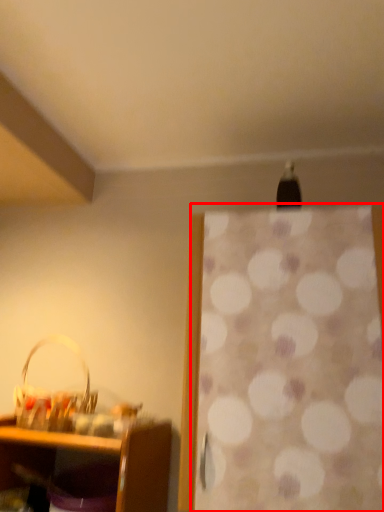
Question: From the image's perspective, what is the correct spatial relationship of curtain (annotated by the red box) in relation to basket?

Choices:
 (A) below
 (B) above

Answer: (B)